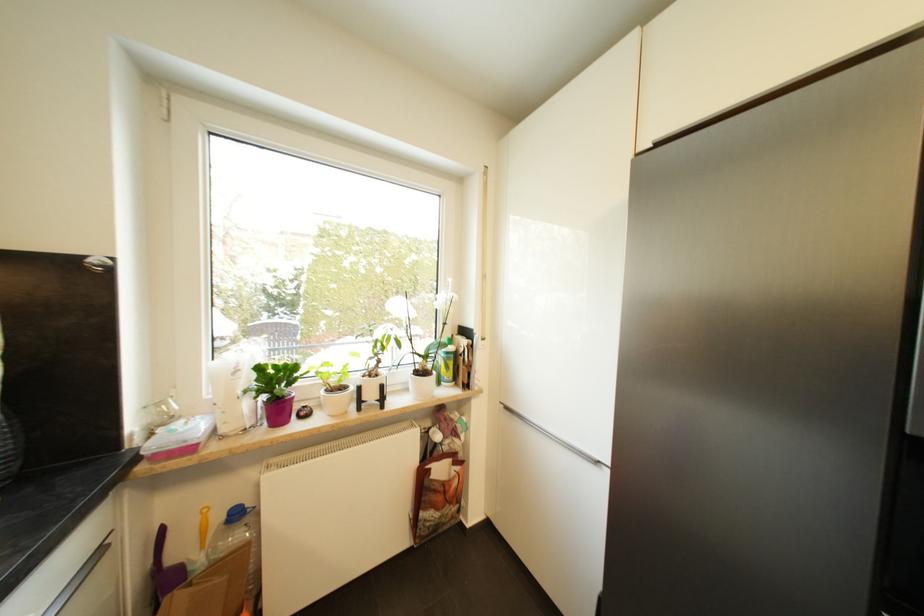
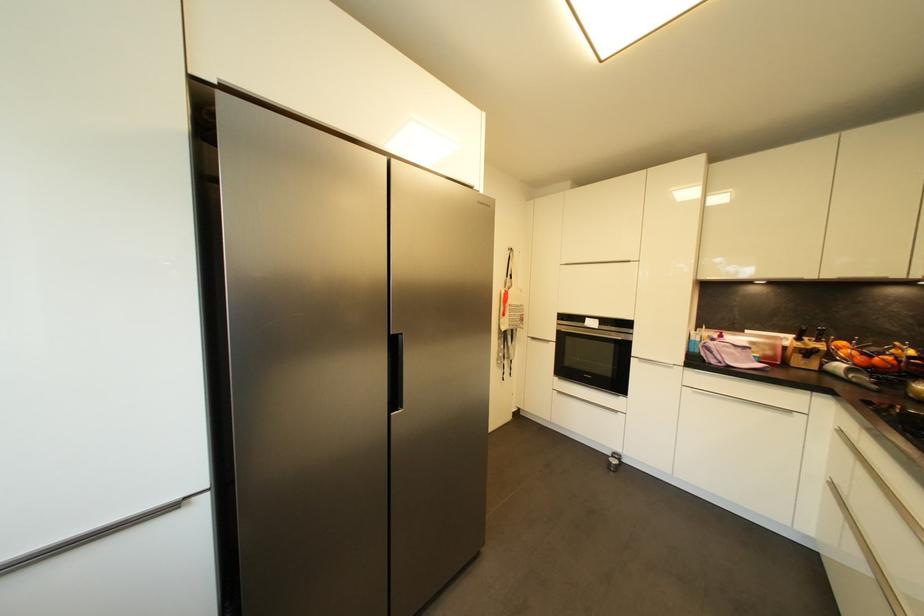
Question: How did the camera likely rotate?

Choices:
 (A) Left
 (B) Right
 (C) Up
 (D) Down

Answer: (B)